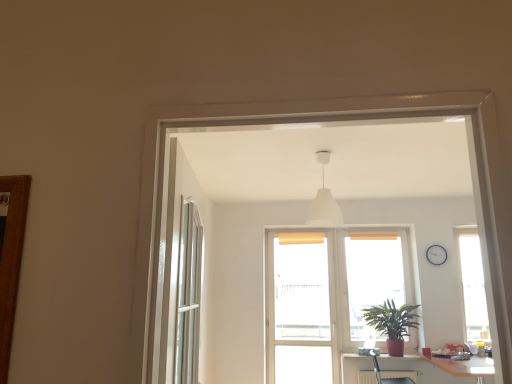
Question: Should I look upward or downward to see white plastic clock at upper right?

Choices:
 (A) down
 (B) up

Answer: (A)

Question: Is white glossy table at lower right positioned in front of metallic silver armchair at lower right?

Choices:
 (A) yes
 (B) no

Answer: (A)

Question: Is white glossy table at lower right bigger than metallic silver armchair at lower right?

Choices:
 (A) yes
 (B) no

Answer: (A)

Question: From the image's perspective, does white glossy table at lower right appear lower than metallic silver armchair at lower right?

Choices:
 (A) no
 (B) yes

Answer: (B)

Question: From the image's perspective, is white glossy table at lower right above metallic silver armchair at lower right?

Choices:
 (A) no
 (B) yes

Answer: (A)

Question: Is metallic silver armchair at lower right at the back of white glossy table at lower right?

Choices:
 (A) no
 (B) yes

Answer: (A)

Question: Would you consider white glossy table at lower right to be distant from metallic silver armchair at lower right?

Choices:
 (A) no
 (B) yes

Answer: (A)

Question: Considering the relative sizes of white glossy table at lower right and green matte plant at lower right in the image provided, is white glossy table at lower right smaller than green matte plant at lower right?

Choices:
 (A) no
 (B) yes

Answer: (A)

Question: Could you tell me if white glossy table at lower right is facing green matte plant at lower right?

Choices:
 (A) yes
 (B) no

Answer: (B)

Question: From a real-world perspective, is white glossy table at lower right on green matte plant at lower right?

Choices:
 (A) yes
 (B) no

Answer: (B)

Question: Is white glossy table at lower right next to green matte plant at lower right?

Choices:
 (A) no
 (B) yes

Answer: (A)

Question: Is white glossy table at lower right oriented away from green matte plant at lower right?

Choices:
 (A) yes
 (B) no

Answer: (B)

Question: Is white glossy table at lower right wider than green matte plant at lower right?

Choices:
 (A) yes
 (B) no

Answer: (A)

Question: Does translucent plastic screen door at center have a smaller size compared to translucent fabric screen at center?

Choices:
 (A) no
 (B) yes

Answer: (A)